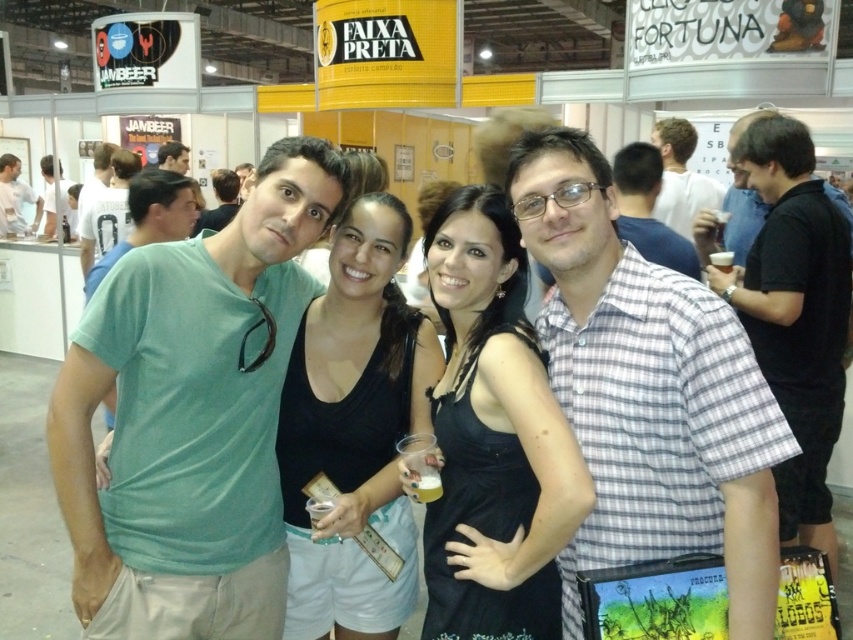
Question: Is green matte shirt at center to the left of green matte t-shirt at left from the viewer's perspective?

Choices:
 (A) yes
 (B) no

Answer: (B)

Question: Is checkered fabric shirt at center wider than black jersey at center?

Choices:
 (A) yes
 (B) no

Answer: (A)

Question: Is black satin dress at center wider than green t-shirt at left?

Choices:
 (A) yes
 (B) no

Answer: (B)

Question: Which point is closer to the camera?

Choices:
 (A) white matte shirt at left
 (B) green cotton t-shirt at center
 (C) green matte shirt at center
 (D) checkered fabric shirt at center

Answer: (D)

Question: Among these points, which one is nearest to the camera?

Choices:
 (A) (659, 259)
 (B) (810, 161)

Answer: (B)

Question: Among these objects, which one is farthest from the camera?

Choices:
 (A) green matte t-shirt at left
 (B) matte green t-shirt at upper left
 (C) green t-shirt at left
 (D) green matte shirt at center

Answer: (C)